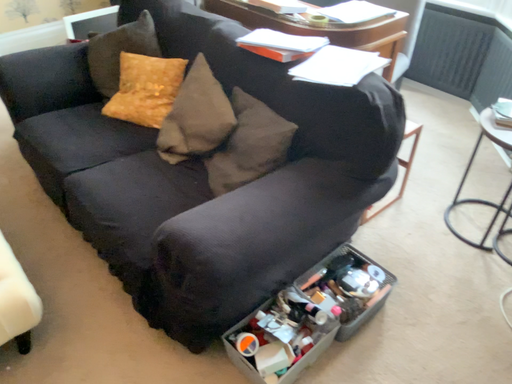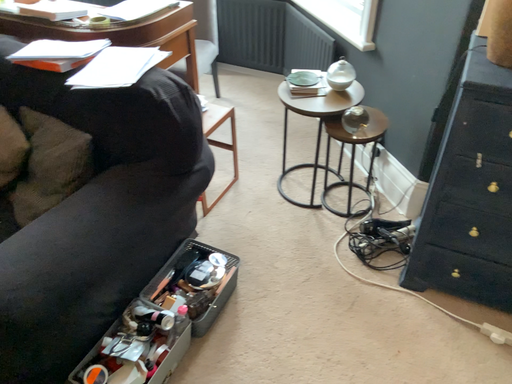
Question: Which way did the camera rotate in the video?

Choices:
 (A) rotated right
 (B) rotated left

Answer: (A)